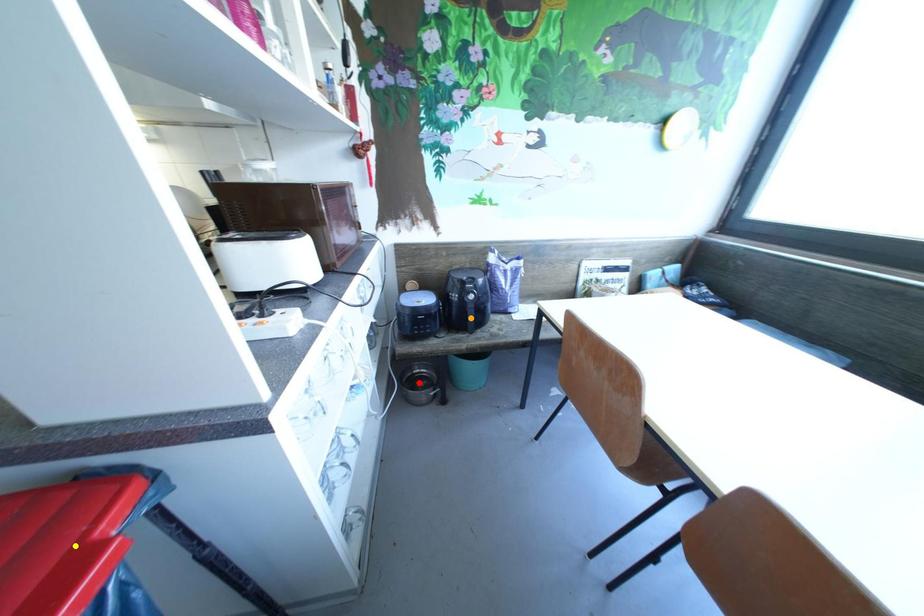
Order these from nearest to farthest:
- orange point
- red point
- yellow point

red point → orange point → yellow point